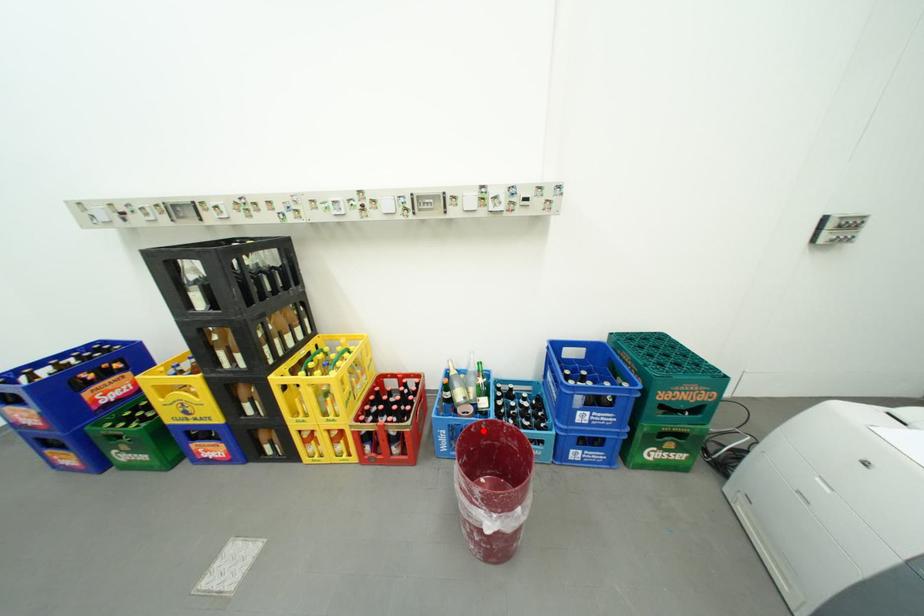
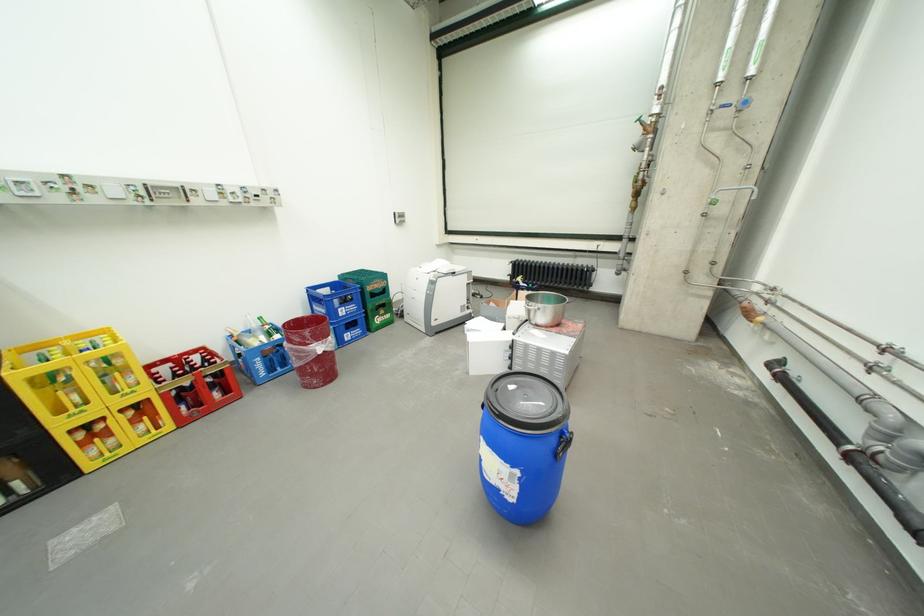
Locate, in the second image, the point that corresponds to the highlighted location in the first image.

(297, 328)